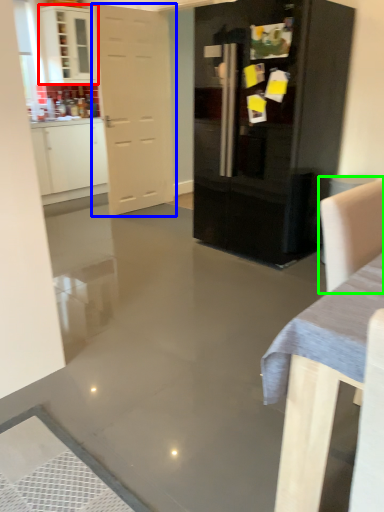
Question: Based on their relative distances, which object is farther from cabinetry (highlighted by a red box)? Choose from door (highlighted by a blue box) and armchair (highlighted by a green box).

Choices:
 (A) door
 (B) armchair

Answer: (B)